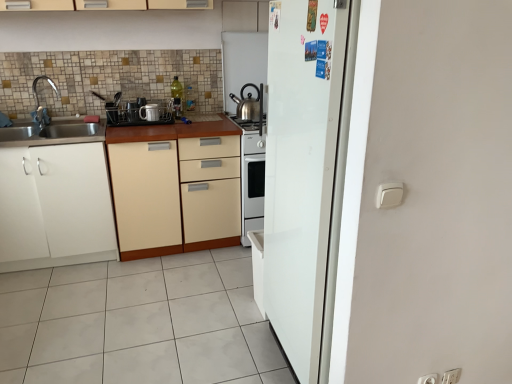
Question: Considering the positions of white matte cabinet at left, placed as the 1th cabinetry when sorted from left to right, and stainless steel kettle at center, which ranks as the first appliance in right-to-left order, in the image, is white matte cabinet at left, placed as the 1th cabinetry when sorted from left to right, wider or thinner than stainless steel kettle at center, which ranks as the first appliance in right-to-left order,?

Choices:
 (A) thin
 (B) wide

Answer: (B)

Question: Is white matte cabinet at left, placed as the 1th cabinetry when sorted from left to right, to the left or to the right of stainless steel kettle at center, which ranks as the first appliance in right-to-left order, in the image?

Choices:
 (A) left
 (B) right

Answer: (A)

Question: Which is farther from the beige matte cabinet at center, positioned as the first cabinetry in right-to-left order?

Choices:
 (A) white tile floor at lower center
 (B) white plastic electric outlet at lower right, the 2th electric outlet positioned from the left
 (C) stainless steel kettle at center, which ranks as the first appliance in right-to-left order
 (D) white plastic electric outlet at lower right, the 1th electric outlet from the left
 (E) brushed metal faucet at left

Answer: (B)

Question: Estimate the real-world distances between objects in this image. Which object is closer to the stainless steel kettle at center, which is the 3th appliance in left-to-right order?

Choices:
 (A) white plastic electric outlet at lower right, which is counted as the first electric outlet, starting from the right
 (B) metallic silver kettle at upper center
 (C) beige matte cabinet at center, positioned as the first cabinetry in right-to-left order
 (D) metallic dish rack at center, the 1th appliance positioned from the left
 (E) white plastic electric outlet at lower right, the 1th electric outlet from the left

Answer: (B)